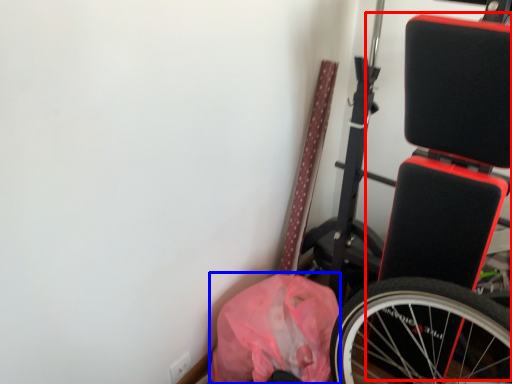
Question: Which of the following is the farthest to the observer, wide (highlighted by a red box) or material (highlighted by a blue box)?

Choices:
 (A) wide
 (B) material

Answer: (B)